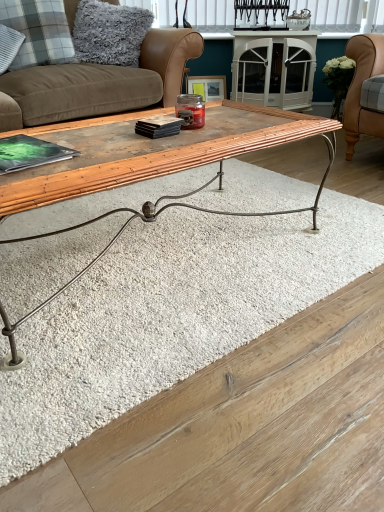
Question: Can you confirm if plaid fabric pillow at upper left, the second pillow positioned from the right, is smaller than white blinds at upper center?

Choices:
 (A) yes
 (B) no

Answer: (B)

Question: Is plaid fabric pillow at upper left, the second pillow positioned from the right, next to white blinds at upper center and touching it?

Choices:
 (A) no
 (B) yes

Answer: (A)

Question: From the image's perspective, does plaid fabric pillow at upper left, which is counted as the 1th pillow, starting from the left, appear lower than white blinds at upper center?

Choices:
 (A) no
 (B) yes

Answer: (B)

Question: Is plaid fabric pillow at upper left, which is counted as the 1th pillow, starting from the left, shorter than white blinds at upper center?

Choices:
 (A) yes
 (B) no

Answer: (B)

Question: Would you say plaid fabric pillow at upper left, the second pillow positioned from the right, is outside white blinds at upper center?

Choices:
 (A) no
 (B) yes

Answer: (B)

Question: Looking at the image, does wooden bamboo coffee table at center seem bigger or smaller compared to gray fluffy pillow at upper left, the 2th pillow viewed from the left?

Choices:
 (A) small
 (B) big

Answer: (B)

Question: Is wooden bamboo coffee table at center situated inside gray fluffy pillow at upper left, the 2th pillow viewed from the left, or outside?

Choices:
 (A) outside
 (B) inside

Answer: (A)

Question: Considering the positions of wooden bamboo coffee table at center and gray fluffy pillow at upper left, which ranks as the first pillow in right-to-left order, in the image, is wooden bamboo coffee table at center taller or shorter than gray fluffy pillow at upper left, which ranks as the first pillow in right-to-left order,?

Choices:
 (A) tall
 (B) short

Answer: (A)

Question: In the image, is wooden bamboo coffee table at center positioned in front of or behind gray fluffy pillow at upper left, the 2th pillow viewed from the left?

Choices:
 (A) front
 (B) behind

Answer: (A)

Question: In the image, is gray fluffy pillow at upper left, the 2th pillow viewed from the left, positioned in front of or behind wooden picture frame at center?

Choices:
 (A) behind
 (B) front

Answer: (B)

Question: Looking at the image, does gray fluffy pillow at upper left, the 2th pillow viewed from the left, seem bigger or smaller compared to wooden picture frame at center?

Choices:
 (A) small
 (B) big

Answer: (B)

Question: Considering the relative positions of gray fluffy pillow at upper left, the 2th pillow viewed from the left, and wooden picture frame at center in the image provided, is gray fluffy pillow at upper left, the 2th pillow viewed from the left, to the left or to the right of wooden picture frame at center?

Choices:
 (A) right
 (B) left

Answer: (B)

Question: From a real-world perspective, is gray fluffy pillow at upper left, the 2th pillow viewed from the left, positioned above or below wooden picture frame at center?

Choices:
 (A) above
 (B) below

Answer: (A)

Question: From the image's perspective, relative to white blinds at upper center, is wooden bamboo coffee table at center above or below?

Choices:
 (A) above
 (B) below

Answer: (B)

Question: Looking at their shapes, would you say wooden bamboo coffee table at center is wider or thinner than white blinds at upper center?

Choices:
 (A) thin
 (B) wide

Answer: (B)